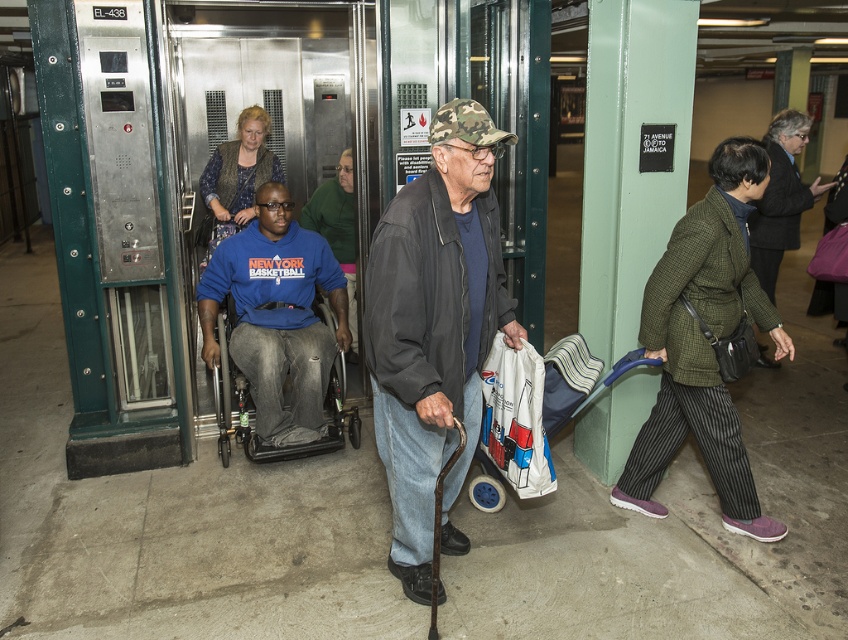
You are a delivery person who needs to place a package in the white plastic bag at center. However, there is a camouflage fabric cap at center in the way. Can you move the package from the camouflage fabric cap to the white plastic bag without moving the cap?

The camouflage fabric cap at center is in front of the white plastic bag at center, so you can move the package from the camouflage fabric cap to the white plastic bag by moving it behind the cap since the bag is behind the cap.

You are a delivery person who needs to hand over a package to the recipient. You see a blue cotton shirt at center and a white plastic bag at center. Which one is closer to your left side?

The blue cotton shirt at center is to the left of white plastic bag at center, so the blue cotton shirt at center is closer to your left side.